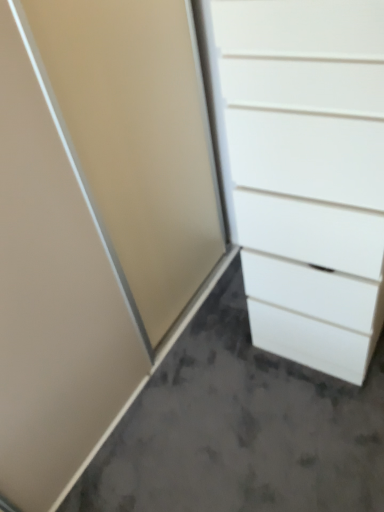
Question: Are white matte concrete at lower right and white matte chest of drawers at right making contact?

Choices:
 (A) yes
 (B) no

Answer: (B)

Question: Is white matte concrete at lower right positioned behind white matte chest of drawers at right?

Choices:
 (A) yes
 (B) no

Answer: (A)

Question: From the image's perspective, is white matte concrete at lower right under white matte chest of drawers at right?

Choices:
 (A) no
 (B) yes

Answer: (B)

Question: Would you say white matte concrete at lower right is a long distance from white matte chest of drawers at right?

Choices:
 (A) yes
 (B) no

Answer: (B)

Question: Is white matte concrete at lower right at the left side of white matte chest of drawers at right?

Choices:
 (A) yes
 (B) no

Answer: (A)

Question: From a real-world perspective, is white matte concrete at lower right located higher than white matte chest of drawers at right?

Choices:
 (A) yes
 (B) no

Answer: (B)

Question: Is white matte chest of drawers at right smaller than white matte concrete at lower right?

Choices:
 (A) yes
 (B) no

Answer: (B)

Question: Is white matte chest of drawers at right bigger than white matte concrete at lower right?

Choices:
 (A) yes
 (B) no

Answer: (A)

Question: Is white matte chest of drawers at right outside of white matte concrete at lower right?

Choices:
 (A) yes
 (B) no

Answer: (A)

Question: From the image's perspective, is white matte chest of drawers at right on top of white matte concrete at lower right?

Choices:
 (A) no
 (B) yes

Answer: (B)

Question: Is white matte chest of drawers at right to the right of white matte concrete at lower right from the viewer's perspective?

Choices:
 (A) yes
 (B) no

Answer: (A)

Question: Does white matte chest of drawers at right have a lesser height compared to white matte concrete at lower right?

Choices:
 (A) no
 (B) yes

Answer: (A)

Question: From their relative heights in the image, would you say white matte concrete at lower right is taller or shorter than white matte chest of drawers at right?

Choices:
 (A) short
 (B) tall

Answer: (A)